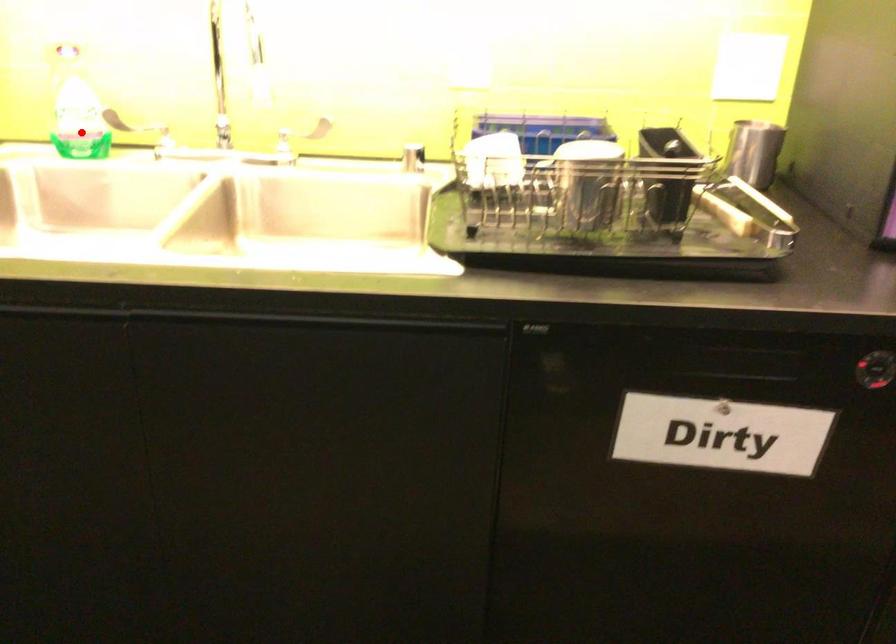
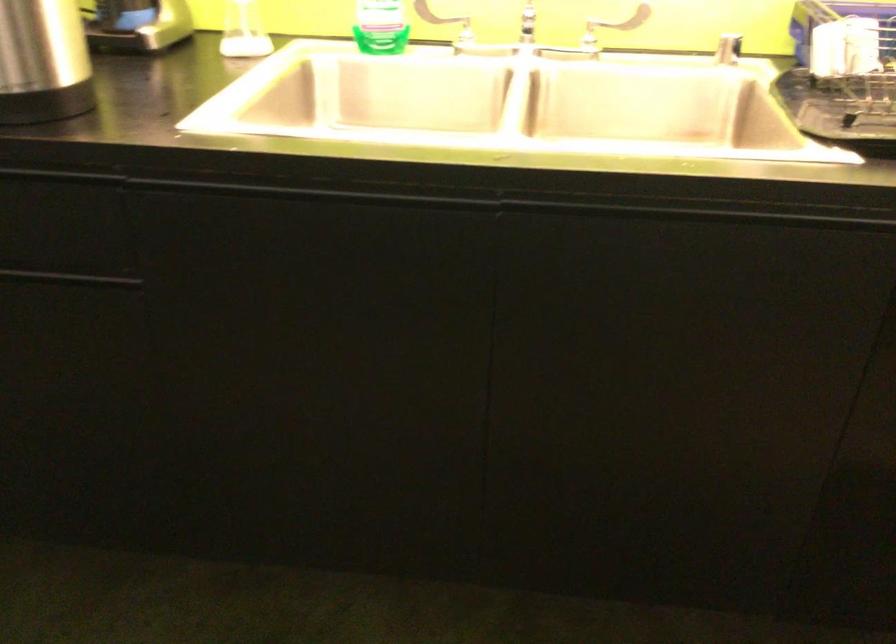
Question: I am providing you with two images of the same scene from different viewpoints. A red point is marked on the first image. Can you still see the location of the red point in image 2?

Choices:
 (A) Yes
 (B) No

Answer: (A)